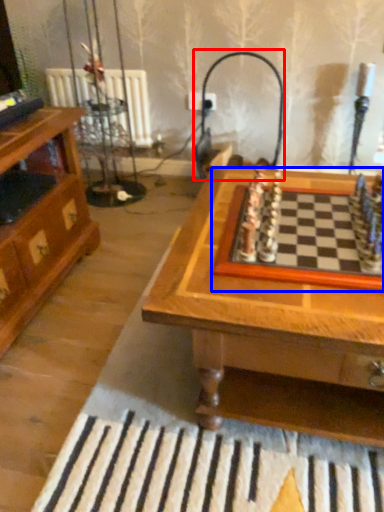
Question: Which of the following is the closest to the observer, lamp (highlighted by a red box) or board game (highlighted by a blue box)?

Choices:
 (A) lamp
 (B) board game

Answer: (B)